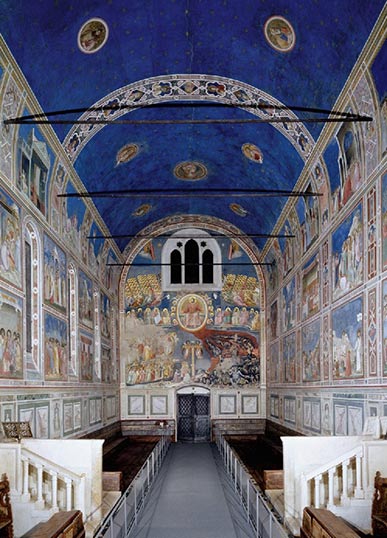
Where is `framed pictures on right side of door`? The width and height of the screenshot is (387, 538). framed pictures on right side of door is located at coordinates (225, 395), (247, 404).